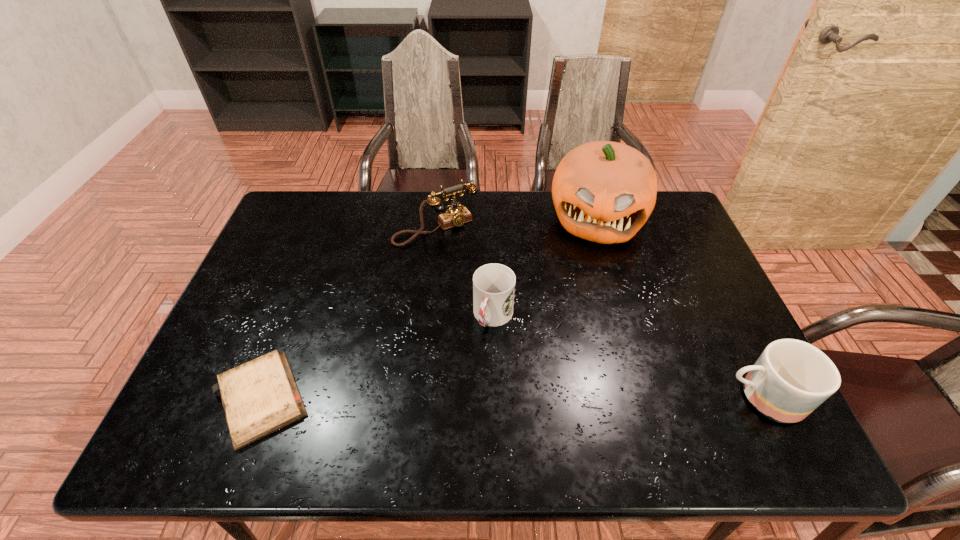
The width and height of the screenshot is (960, 540). Find the location of `free space between the shortest object and the pumpkin`. free space between the shortest object and the pumpkin is located at coordinates (429, 308).

This screenshot has height=540, width=960. I want to click on vacant area between the telephone and the rightmost object, so click(x=599, y=313).

At what (x,y) coordinates should I click in order to perform the action: click on free space that is in between the rightmost object and the telephone. Please return your answer as a coordinate pair (x, y). The height and width of the screenshot is (540, 960). Looking at the image, I should click on (599, 313).

This screenshot has height=540, width=960. In order to click on vacant area that lies between the tallest object and the rightmost object in this screenshot , I will do `click(679, 308)`.

Locate an element on the screen. free space between the telephone and the third farthest object is located at coordinates (465, 273).

At what (x,y) coordinates should I click in order to perform the action: click on vacant area that lies between the telephone and the cup. Please return your answer as a coordinate pair (x, y). The height and width of the screenshot is (540, 960). Looking at the image, I should click on (465, 273).

This screenshot has height=540, width=960. Identify the location of vacant point located between the third nearest object and the diary. (378, 357).

Select which object is the closest to the shortest object. Please provide its 2D coordinates. Your answer should be formatted as a tuple, i.e. [(x, y)], where the tuple contains the x and y coordinates of a point satisfying the conditions above.

[(493, 284)]

You are a GUI agent. You are given a task and a screenshot of the screen. Output one action in this format:
    pyautogui.click(x=<x>, y=<y>)
    Task: Click on the third closest object relative to the third nearest object
    This screenshot has width=960, height=540.
    Given the screenshot: What is the action you would take?
    pyautogui.click(x=259, y=397)

Find the location of `vacant area that satisfies the following two spatial constraints: 1. on the back side of the shortest object; 2. on the right side of the third nearest object`. vacant area that satisfies the following two spatial constraints: 1. on the back side of the shortest object; 2. on the right side of the third nearest object is located at coordinates (293, 317).